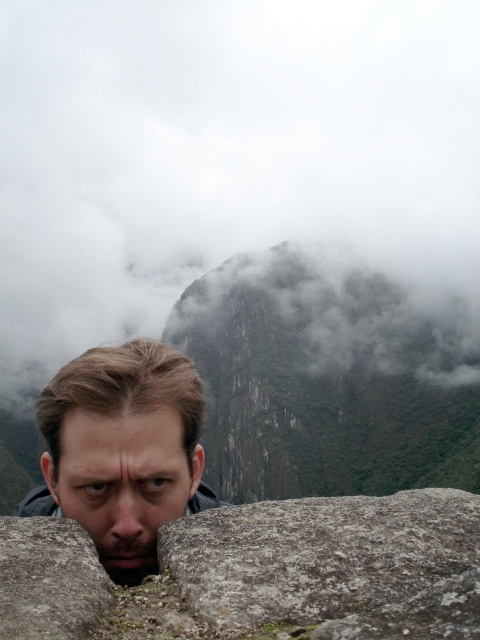
Question: Does gray rough rock at center appear on the right side of smooth skin face at center?

Choices:
 (A) yes
 (B) no

Answer: (A)

Question: Which is farther from the cloudy mist at upper center?

Choices:
 (A) gray rough stone at lower left
 (B) smooth brown hair at center

Answer: (B)

Question: Which object is the closest to the gray rough rock at center?

Choices:
 (A) gray rough stone at lower left
 (B) smooth brown hair at center

Answer: (A)

Question: Which object appears closest to the camera in this image?

Choices:
 (A) gray rough stone at lower left
 (B) gray rough rock at center
 (C) cloudy mist at upper center

Answer: (A)

Question: Is gray rough rock at center wider than smooth brown hair at center?

Choices:
 (A) yes
 (B) no

Answer: (B)

Question: Can you confirm if cloudy mist at upper center is smaller than smooth skin face at center?

Choices:
 (A) no
 (B) yes

Answer: (A)